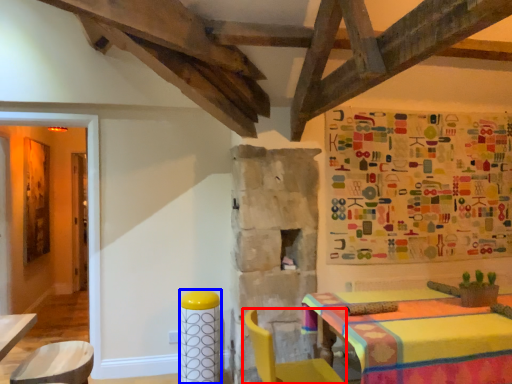
Question: Which object appears farthest to the camera in this image, chair (highlighted by a red box) or bar stool (highlighted by a blue box)?

Choices:
 (A) chair
 (B) bar stool

Answer: (B)